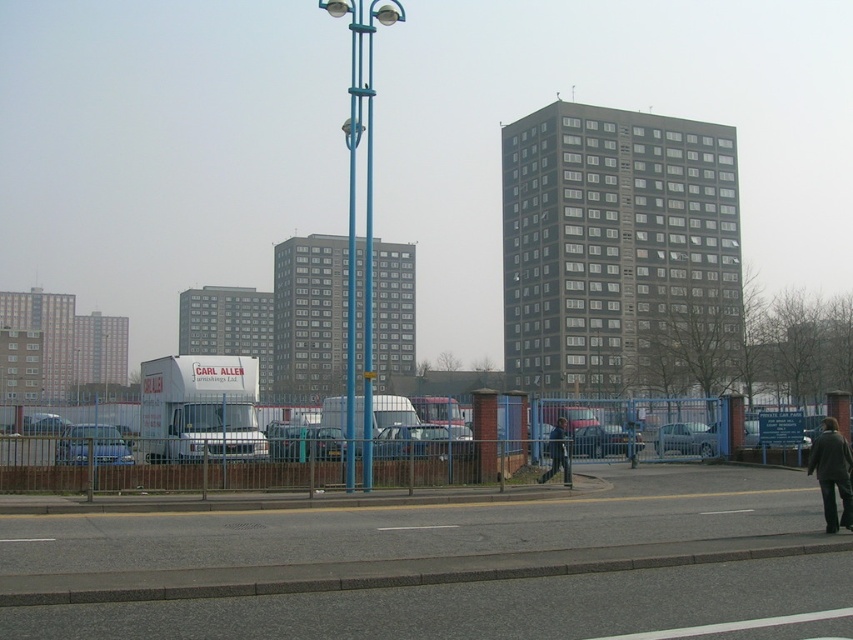
Can you confirm if dark gray coat at lower right is thinner than dark gray jacket at center?

In fact, dark gray coat at lower right might be wider than dark gray jacket at center.

Does dark gray coat at lower right have a smaller size compared to dark gray jacket at center?

No, dark gray coat at lower right is not smaller than dark gray jacket at center.

Which is in front, point (846, 518) or point (550, 451)?

Positioned in front is point (846, 518).

I want to click on dark gray coat at lower right, so click(833, 474).